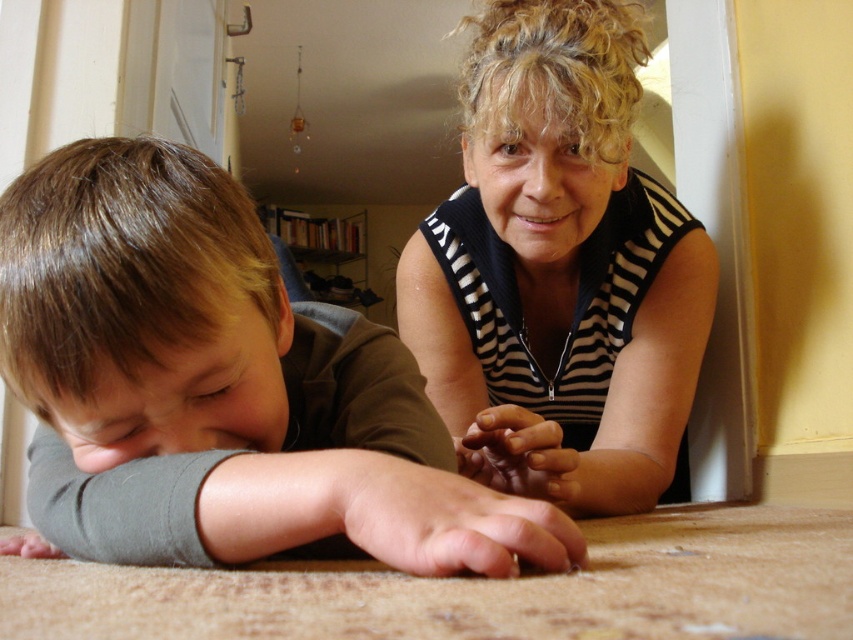
Does brown matte shirt at lower left appear under black striped shirt at upper center?

Correct, brown matte shirt at lower left is located below black striped shirt at upper center.

Does brown matte shirt at lower left have a greater height compared to black striped shirt at upper center?

No.

What are the coordinates of `brown matte shirt at lower left` in the screenshot? It's located at (230, 372).

At what (x,y) coordinates should I click in order to perform the action: click on brown matte shirt at lower left. Please return your answer as a coordinate pair (x, y). This screenshot has width=853, height=640. Looking at the image, I should click on (230, 372).